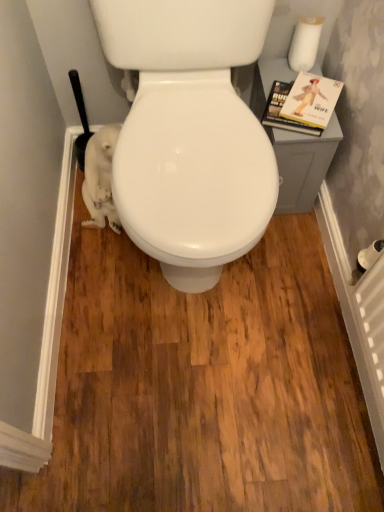
Question: From a real-world perspective, is hardcover book at upper right positioned above or below white matte toilet paper at upper right?

Choices:
 (A) below
 (B) above

Answer: (A)

Question: Looking at their shapes, would you say hardcover book at upper right is wider or thinner than white matte toilet paper at upper right?

Choices:
 (A) thin
 (B) wide

Answer: (B)

Question: In terms of size, does hardcover book at upper right appear bigger or smaller than white matte toilet paper at upper right?

Choices:
 (A) small
 (B) big

Answer: (B)

Question: Choose the correct answer: Is white matte toilet paper at upper right inside hardcover book at upper right or outside it?

Choices:
 (A) outside
 (B) inside

Answer: (A)

Question: Based on their positions, is white matte toilet paper at upper right located to the left or right of hardcover book at upper right?

Choices:
 (A) left
 (B) right

Answer: (B)

Question: Is point pos(294,53) closer or farther from the camera than point pos(306,121)?

Choices:
 (A) closer
 (B) farther

Answer: (B)

Question: From the image's perspective, is white matte toilet paper at upper right above or below hardcover book at upper right?

Choices:
 (A) below
 (B) above

Answer: (B)